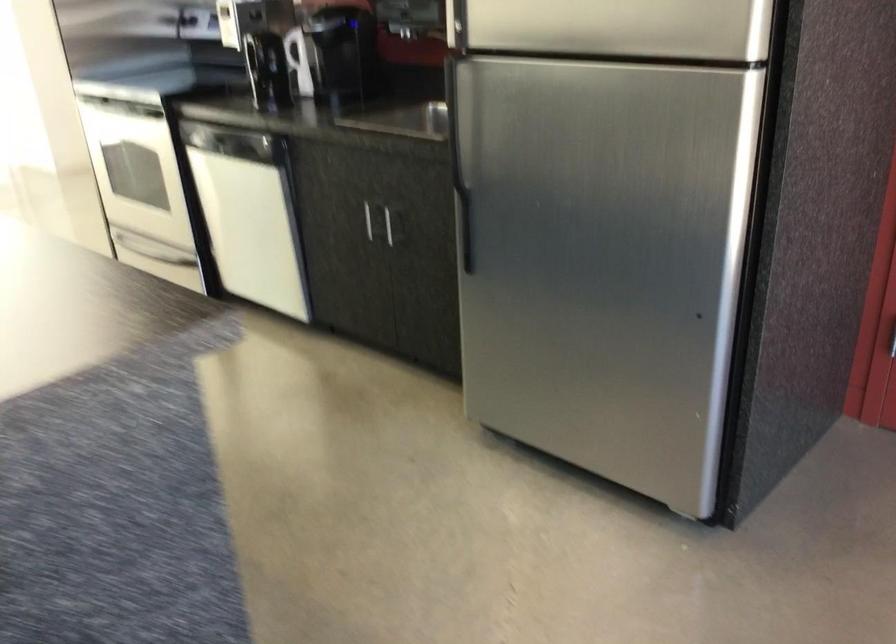
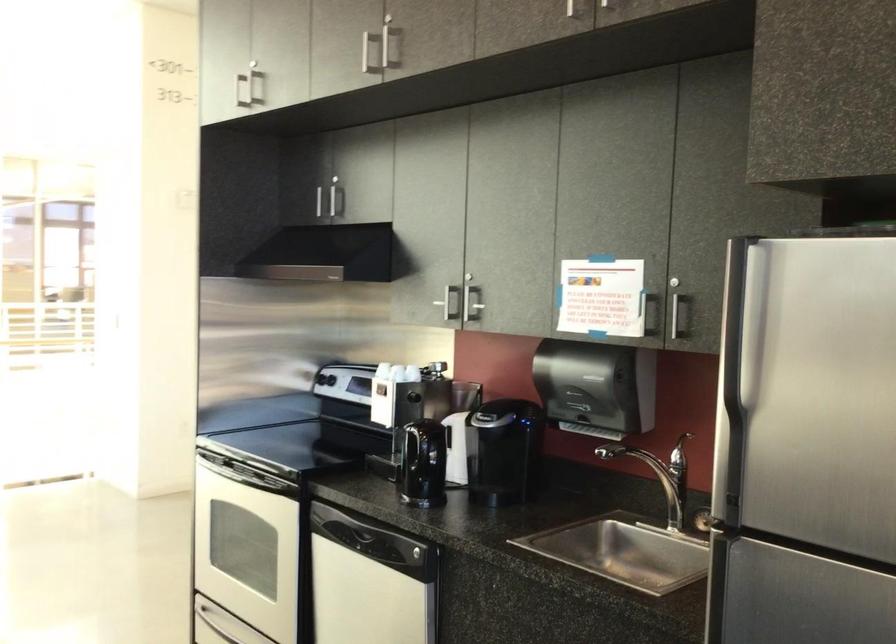
The images are taken continuously from a first-person perspective. In which direction are you moving?

The cameraman walked toward left, forward.